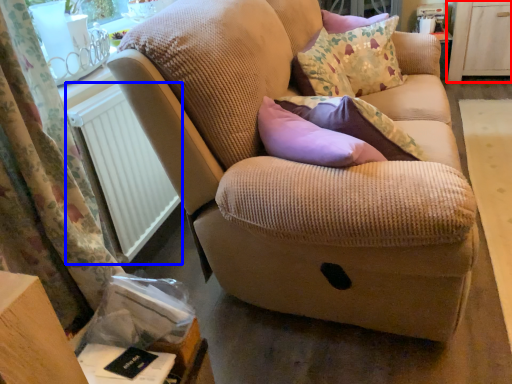
Question: Which point is further to the camera, dresser (highlighted by a red box) or radiator (highlighted by a blue box)?

Choices:
 (A) dresser
 (B) radiator

Answer: (A)